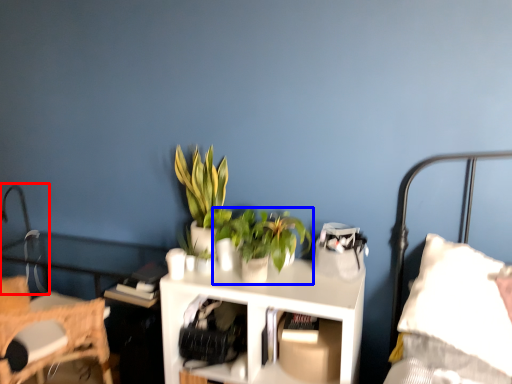
Question: Among these objects, which one is nearest to the camera, table lamp (highlighted by a red box) or houseplant (highlighted by a blue box)?

Choices:
 (A) table lamp
 (B) houseplant

Answer: (B)